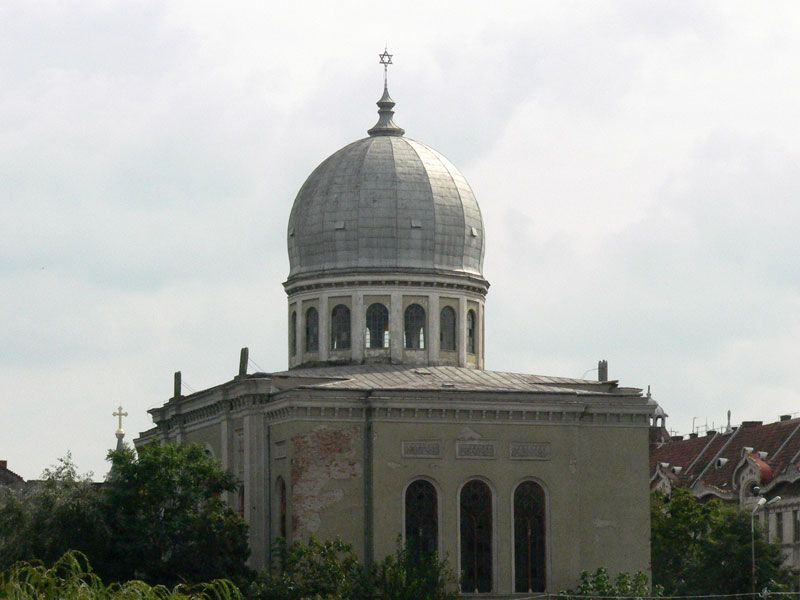
At what (x,y) coordinates should I click in order to perform the action: click on long arched windows. Please return your answer as a coordinate pair (x, y). The height and width of the screenshot is (600, 800). Looking at the image, I should click on (422, 518), (478, 504), (530, 514).